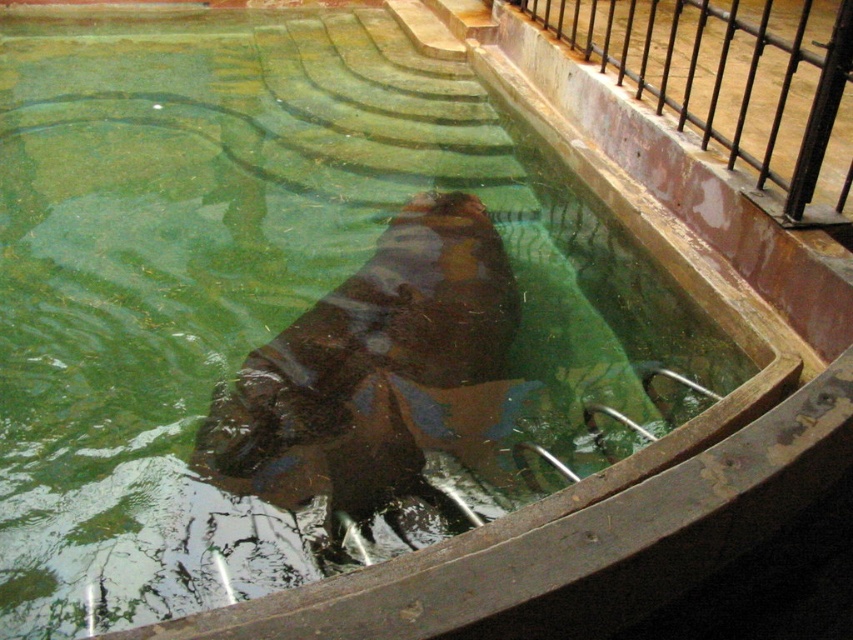
You are a zookeeper who needs to feed the brown matte hippo at center. The feeding tool you have can reach up to 6 feet. Can you safely feed the hippo without entering the enclosure from the area near the black metal rail at upper right?

The brown matte hippo at center is 6.38 feet from the black metal rail at upper right. Since the feeding tool can only reach up to 6 feet, it is not long enough to safely reach the hippo from the rail area. You would need a longer tool or a different approach.

You are standing at the entrance of the hippo enclosure and see two points marked in the image. One is at point (351, 433) and the other is at point (842, 36). Which point is nearer to you?

Point (351, 433) is closer to the viewer than point (842, 36).

You are a zookeeper who needs to ensure the safety of visitors. The brown matte hippo at center is near the black metal rail at upper right. Is there a risk that the hippo could reach the rail and potentially harm visitors?

The brown matte hippo at center is smaller than the black metal rail at upper right, so it is unlikely that the hippo can reach the rail to harm visitors.